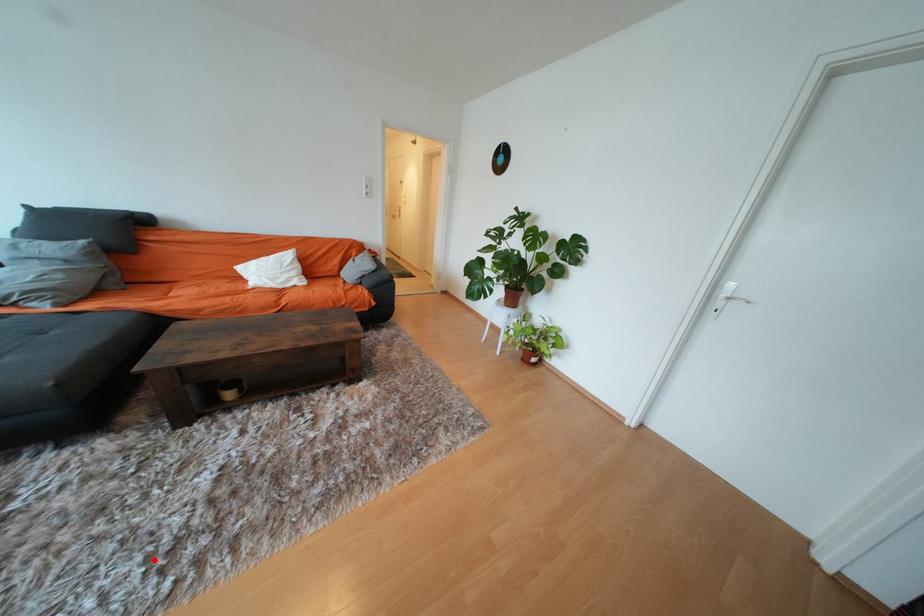
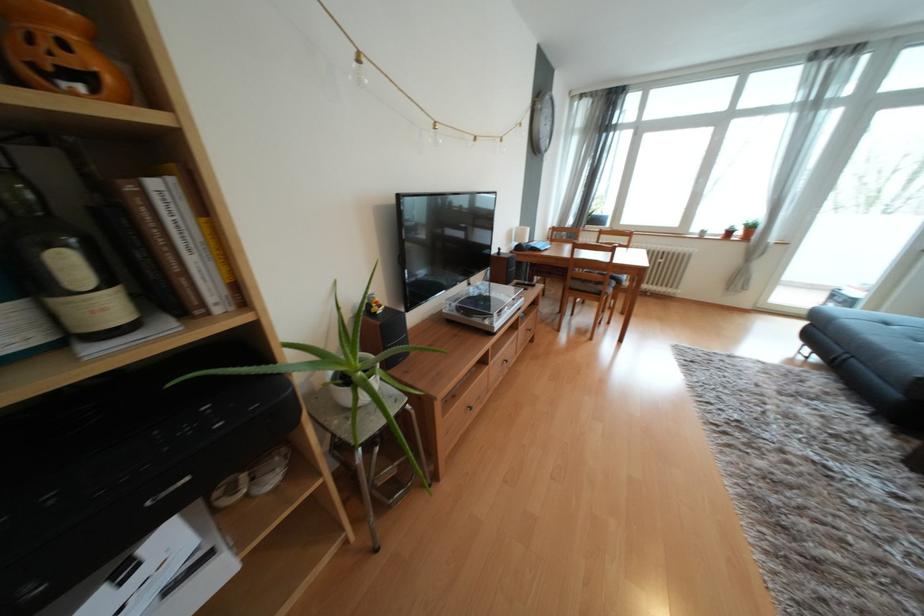
Find the pixel in the second image that matches the highlighted location in the first image.

(745, 424)